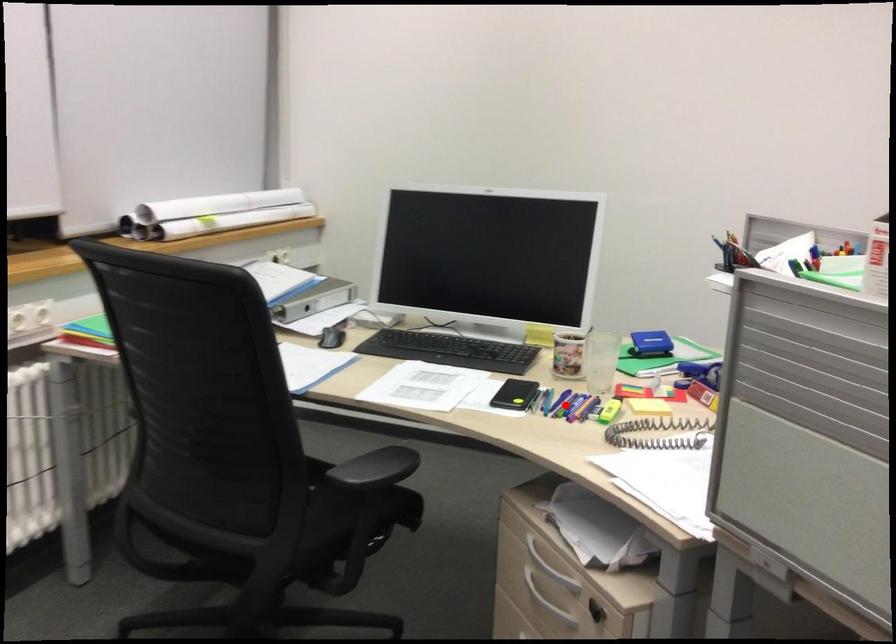
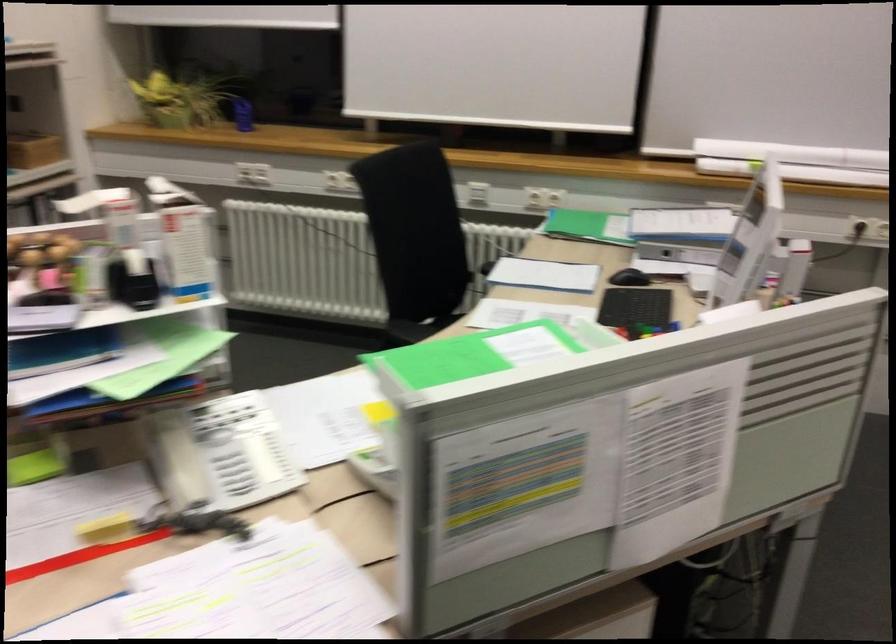
Question: I am providing you with two images of the same scene from different viewpoints. A red point is marked on the first image. Can you still see the location of the red point in image 2?

Choices:
 (A) Yes
 (B) No

Answer: (B)